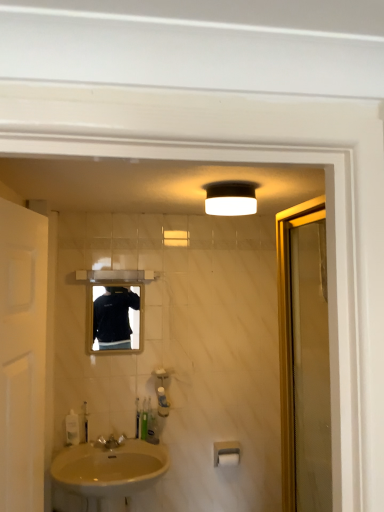
Locate an element on the screen. The image size is (384, 512). free location to the right of translucent plastic soap dispenser at lower left is located at coordinates (106, 444).